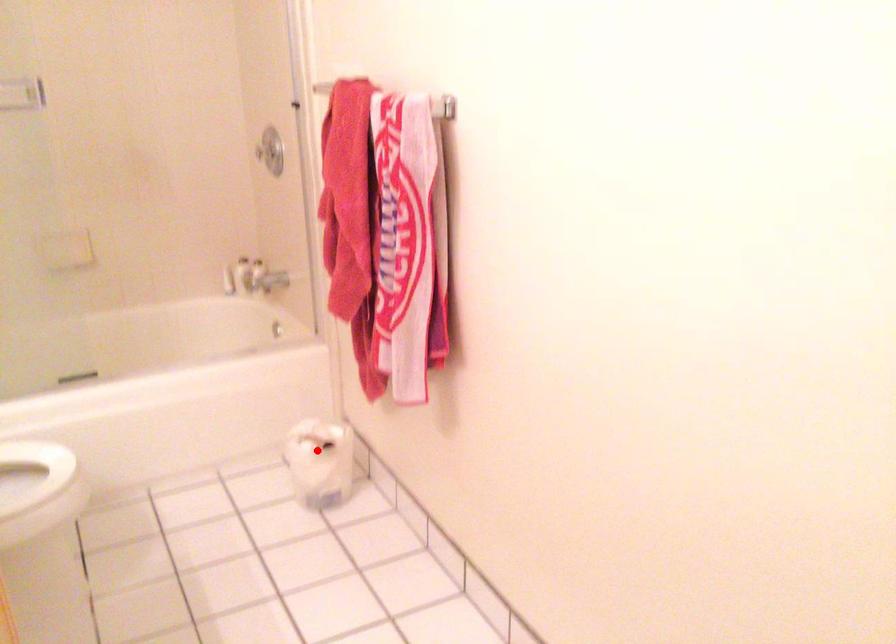
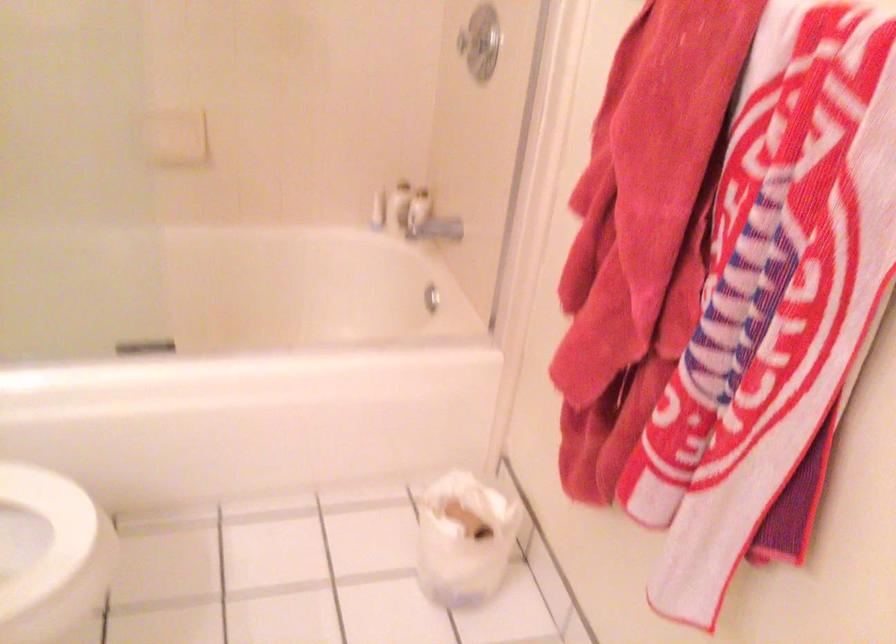
Question: I am providing you with two images of the same scene from different viewpoints. In image1, a red point is highlighted. Considering the same 3D point in image2, which of the following is correct?

Choices:
 (A) It is closer
 (B) It is farther

Answer: (A)